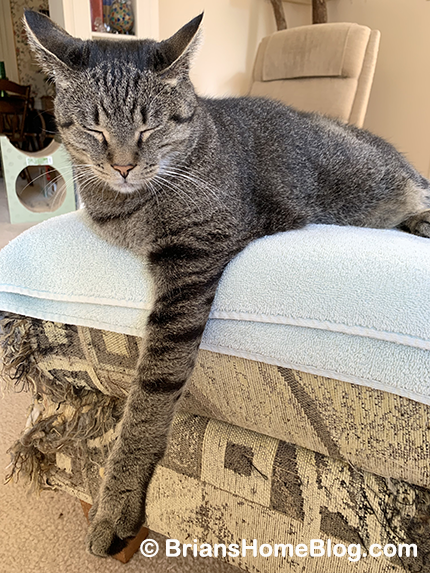
This screenshot has width=430, height=573. I want to click on floor, so click(23, 564).